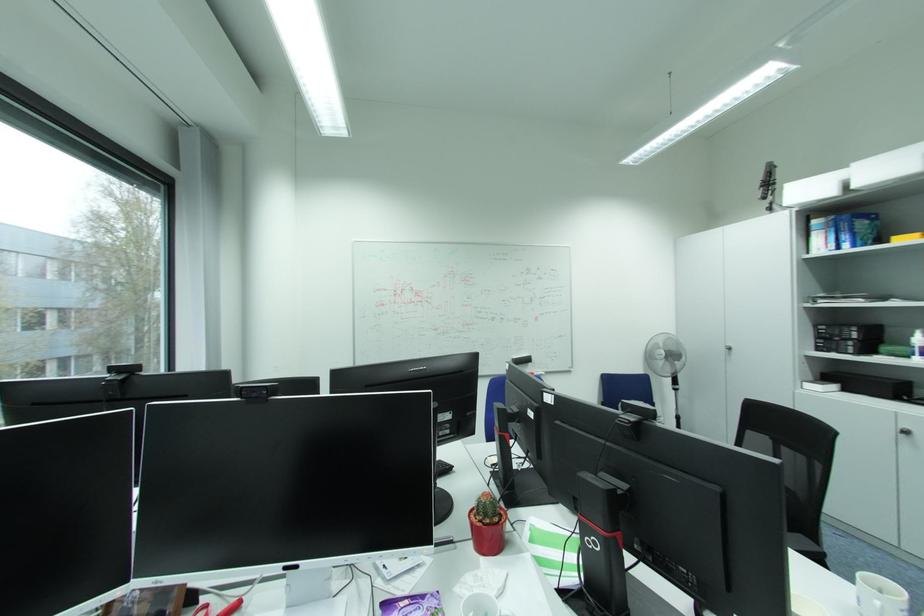
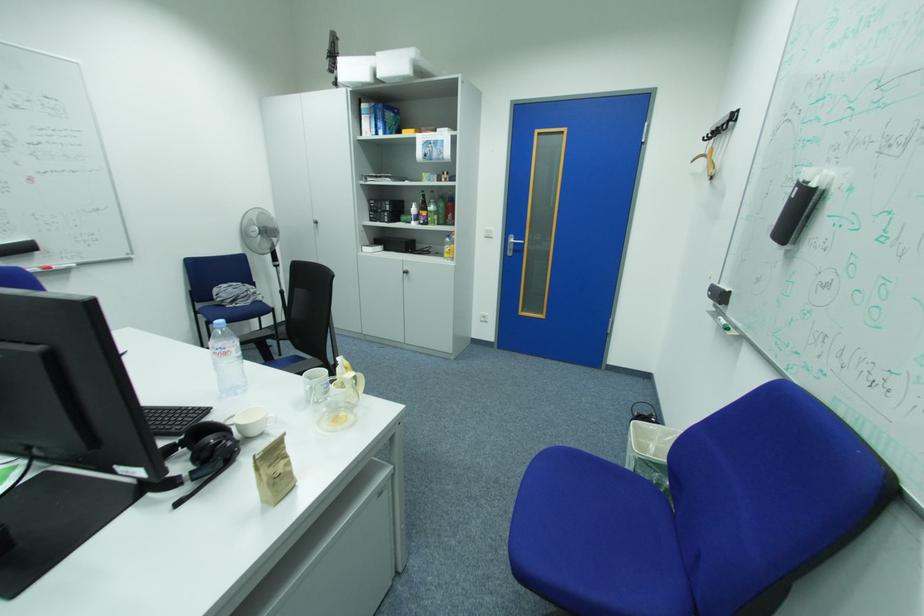
The point at (x=536, y=361) is marked in the first image. Where is the corresponding point in the second image?

(33, 249)